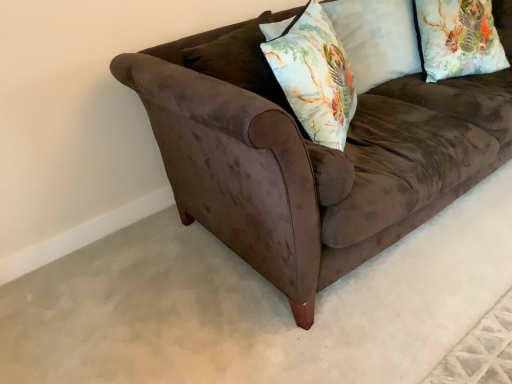
Question: Considering the positions of floral fabric pillow at upper right, the 2th pillow when ordered from left to right, and floral fabric pillow at center in the image, is floral fabric pillow at upper right, the 2th pillow when ordered from left to right, taller or shorter than floral fabric pillow at center?

Choices:
 (A) tall
 (B) short

Answer: (B)

Question: From a real-world perspective, is floral fabric pillow at upper right, placed as the 1th pillow when sorted from right to left, positioned above or below floral fabric pillow at center?

Choices:
 (A) below
 (B) above

Answer: (A)

Question: Estimate the real-world distances between objects in this image. Which object is farther from the floral fabric pillow at upper right, placed as the 1th pillow when sorted from right to left?

Choices:
 (A) floral fabric pillow at center
 (B) brown velvet couch at center
 (C) floral fabric pillow at upper right, which is the 1th pillow in left-to-right order

Answer: (A)

Question: Considering the real-world distances, which object is farthest from the floral fabric pillow at upper right, arranged as the 2th pillow when viewed from the right?

Choices:
 (A) floral fabric pillow at center
 (B) brown velvet couch at center
 (C) floral fabric pillow at upper right, placed as the 1th pillow when sorted from right to left

Answer: (B)